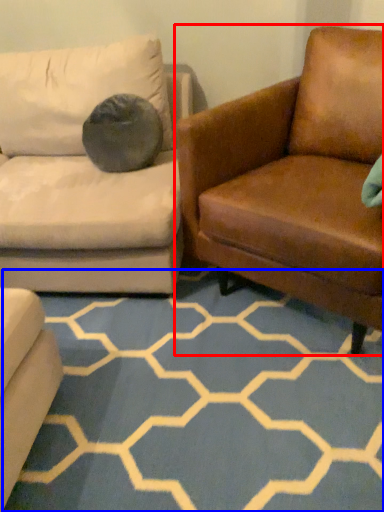
Question: Which object is closer to the camera taking this photo, studio couch (highlighted by a red box) or pattern (highlighted by a blue box)?

Choices:
 (A) studio couch
 (B) pattern

Answer: (A)